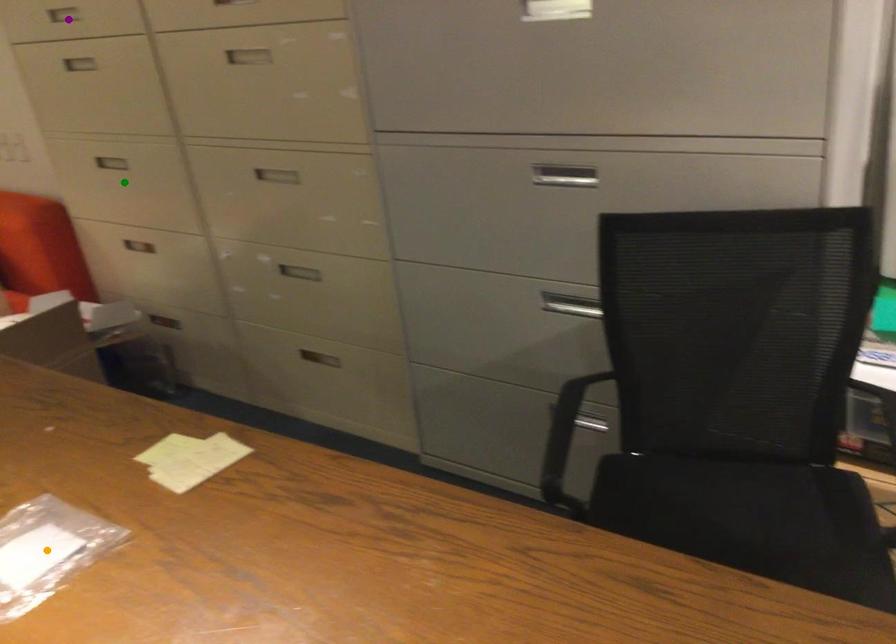
Order these from nearest to farthest:
A) purple point
B) green point
C) orange point

orange point
purple point
green point